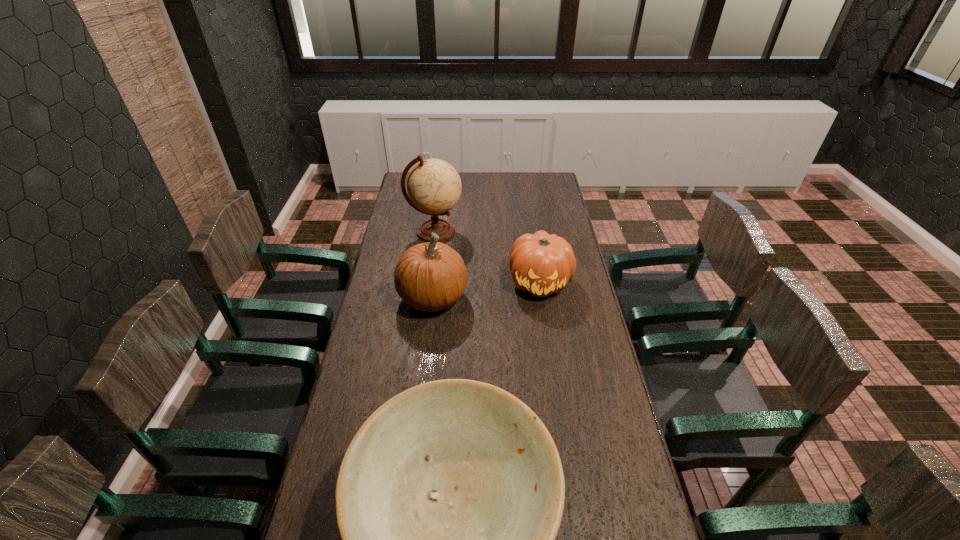
Find the location of a particular element. globe is located at coordinates (434, 186).

Identify the location of the tallest object. Image resolution: width=960 pixels, height=540 pixels. (434, 186).

Image resolution: width=960 pixels, height=540 pixels. What are the coordinates of `the taller pumpkin` in the screenshot? It's located at (432, 276).

Identify the location of the second tallest object. (432, 276).

The image size is (960, 540). What are the coordinates of `the right pumpkin` in the screenshot? It's located at click(x=541, y=264).

Find the location of `free space located 0.400m on the surface of the globe`. free space located 0.400m on the surface of the globe is located at coordinates (547, 232).

Identify the location of vacant area located 0.110m on the stem of the taller pumpkin. The height and width of the screenshot is (540, 960). (496, 298).

This screenshot has height=540, width=960. Find the location of `vacant space positioned on the carved face of the right pumpkin`. vacant space positioned on the carved face of the right pumpkin is located at coordinates (552, 364).

I want to click on globe that is at the left edge, so click(x=434, y=186).

What are the coordinates of `pumpkin positioned at the left edge` in the screenshot? It's located at (432, 276).